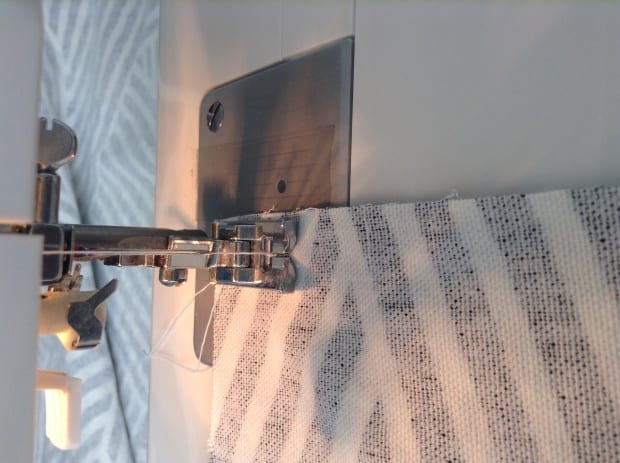
At what (x,y) coordinates should I click in order to perform the action: click on light. Please return your answer as a coordinate pair (x, y). Looking at the image, I should click on click(190, 130), click(186, 142), click(186, 156), click(186, 160), click(188, 176), click(172, 146), click(179, 180), click(183, 197), click(188, 205), click(15, 219).